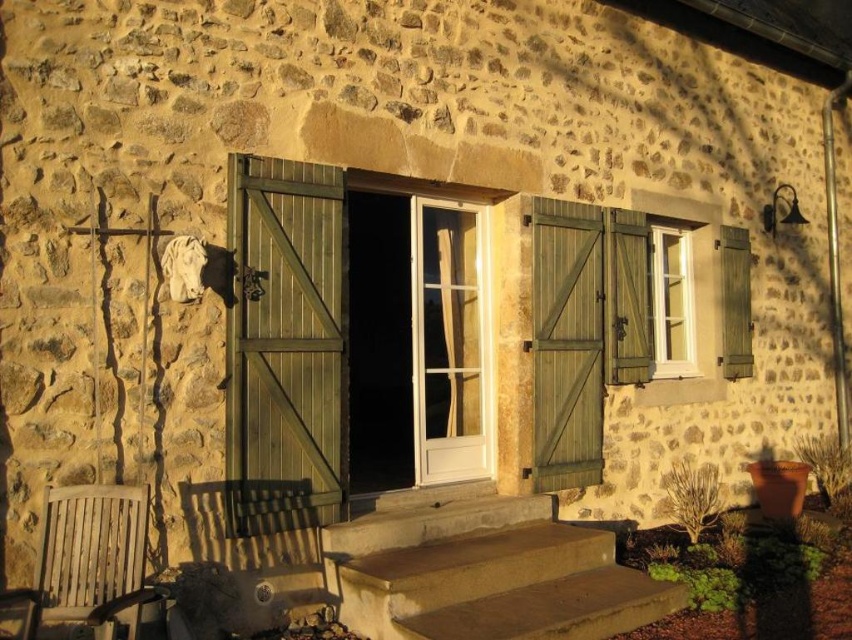
Between wooden slats chair at lower left and white plastic window at upper right, which one appears on the right side from the viewer's perspective?

white plastic window at upper right

Does wooden slats chair at lower left have a lesser width compared to white plastic window at upper right?

In fact, wooden slats chair at lower left might be wider than white plastic window at upper right.

Is point (139, 556) behind point (684, 273)?

No.

This screenshot has width=852, height=640. Find the location of `wooden slats chair at lower left`. wooden slats chair at lower left is located at coordinates (88, 561).

In the scene shown: How distant is smooth concrete steps at center from white plastic window at upper right?

smooth concrete steps at center is 2.94 meters from white plastic window at upper right.

Is smooth concrete steps at center positioned in front of white plastic window at upper right?

Yes, smooth concrete steps at center is closer to the viewer.

Between point (646, 611) and point (652, 244), which one is positioned behind?

The point (652, 244) is behind.

Find the location of a particular element. The width and height of the screenshot is (852, 640). smooth concrete steps at center is located at coordinates (468, 572).

Is smooth concrete steps at center positioned before wooden slats chair at lower left?

That is False.

Locate an element on the screen. Image resolution: width=852 pixels, height=640 pixels. smooth concrete steps at center is located at coordinates (468, 572).

Where is `smooth concrete steps at center`? smooth concrete steps at center is located at coordinates (468, 572).